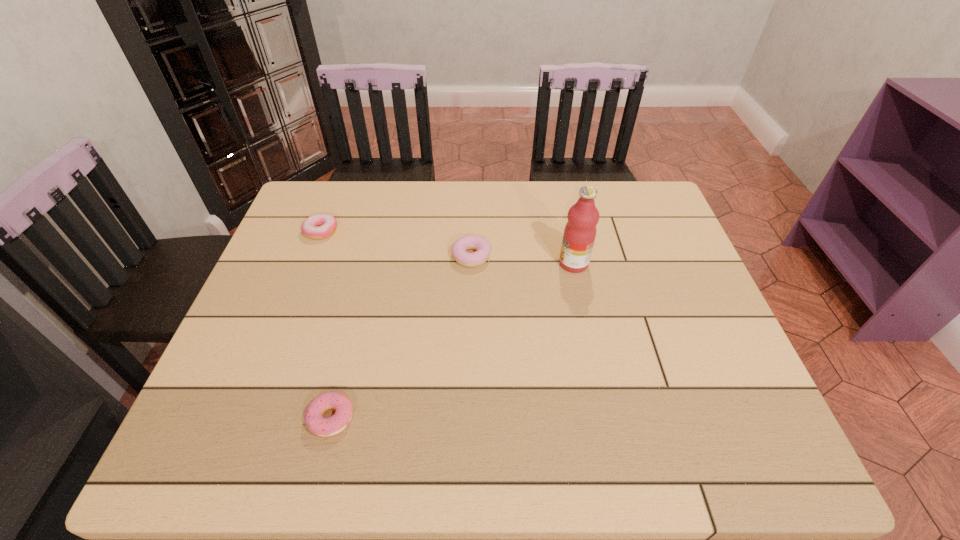
You are a GUI agent. You are given a task and a screenshot of the screen. Output one action in this format:
    pyautogui.click(x=<x>, y=<y>)
    Task: Click on the fruit juice
    The width and height of the screenshot is (960, 540).
    Given the screenshot: What is the action you would take?
    pyautogui.click(x=580, y=231)

Identify the location of the tallest object. (580, 231).

I want to click on the rightmost doughnut, so click(477, 258).

Locate an element on the screen. The height and width of the screenshot is (540, 960). the third object from left to right is located at coordinates pyautogui.click(x=477, y=258).

This screenshot has width=960, height=540. Identify the location of the leftmost object. (318, 226).

Find the location of a particular element. the farthest object is located at coordinates (318, 226).

Locate an element on the screen. The width and height of the screenshot is (960, 540). the nearest object is located at coordinates (324, 427).

This screenshot has width=960, height=540. I want to click on the second doughnut from left to right, so click(324, 427).

This screenshot has height=540, width=960. I want to click on blank area located 0.080m on the label of the tallest object, so click(x=529, y=264).

Where is `free point located 0.310m on the label of the tallest object`? This screenshot has width=960, height=540. free point located 0.310m on the label of the tallest object is located at coordinates (444, 264).